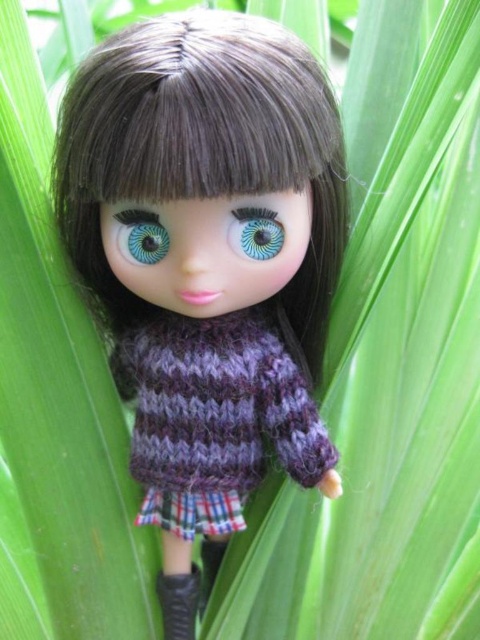
Is blue iridescent eye at center above blue glossy eye at center?

Yes, blue iridescent eye at center is above blue glossy eye at center.

Does blue iridescent eye at center appear on the left side of blue glossy eye at center?

No, blue iridescent eye at center is not to the left of blue glossy eye at center.

Which is behind, point (253, 218) or point (129, 259)?

The point (129, 259) is behind.

I want to click on blue iridescent eye at center, so click(x=255, y=232).

Does knitted purple sweater at center have a smaller size compared to blue iridescent eye at center?

Incorrect, knitted purple sweater at center is not smaller in size than blue iridescent eye at center.

Which is more to the right, knitted purple sweater at center or blue iridescent eye at center?

From the viewer's perspective, blue iridescent eye at center appears more on the right side.

Is point (96, 138) less distant than point (233, 237)?

Yes, point (96, 138) is in front of point (233, 237).

You are a GUI agent. You are given a task and a screenshot of the screen. Output one action in this format:
    pyautogui.click(x=<x>, y=<y>)
    Task: Click on the knitted purple sweater at center
    
    Given the screenshot: What is the action you would take?
    pyautogui.click(x=207, y=257)

Between knitted purple sweater at center and black leather boot at lower center, which one has less height?

black leather boot at lower center is shorter.

Does point (187, 161) lie behind point (187, 627)?

No.

Is point (144, 392) closer to viewer compared to point (159, 573)?

Yes, it is.

Where is `knitted purple sweater at center`? Image resolution: width=480 pixels, height=640 pixels. knitted purple sweater at center is located at coordinates (207, 257).